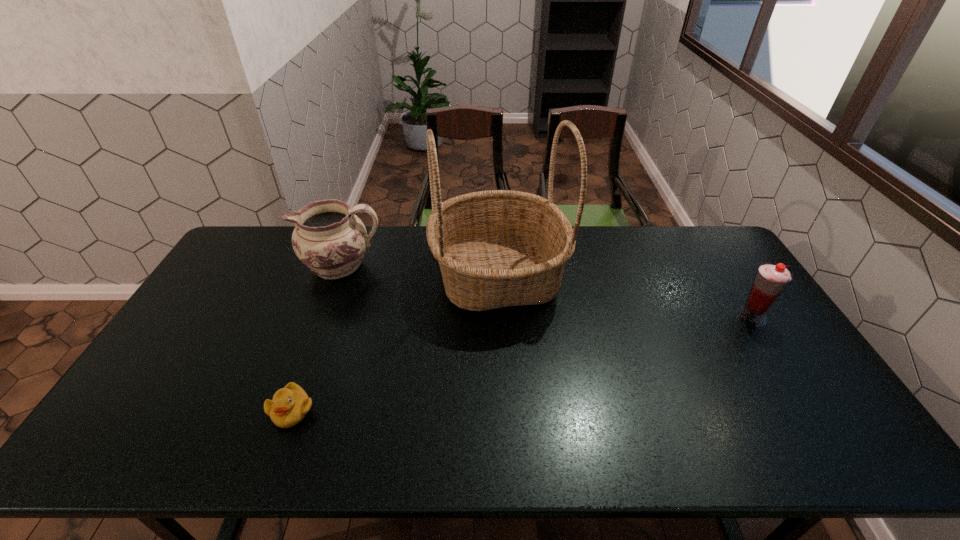
You are a GUI agent. You are given a task and a screenshot of the screen. Output one action in this format:
    pyautogui.click(x=<x>, y=<y>)
    Task: Click on the object that is the third closest to the nearest object
    
    Given the screenshot: What is the action you would take?
    pyautogui.click(x=771, y=279)

The width and height of the screenshot is (960, 540). In order to click on vacant area that satisfies the following two spatial constraints: 1. on the front side of the tallest object; 2. on the right side of the rightmost object in this screenshot , I will do `click(500, 316)`.

This screenshot has height=540, width=960. I want to click on vacant space that satisfies the following two spatial constraints: 1. on the spout of the pitcher; 2. on the right side of the third object from left to right, so click(339, 276).

Where is `free space in the image that satisfies the following two spatial constraints: 1. on the spout of the pitcher; 2. on the left side of the basket`? This screenshot has height=540, width=960. free space in the image that satisfies the following two spatial constraints: 1. on the spout of the pitcher; 2. on the left side of the basket is located at coordinates (339, 276).

Where is `free space that satisfies the following two spatial constraints: 1. on the front side of the smoothie; 2. on the left side of the third object from left to right`? This screenshot has height=540, width=960. free space that satisfies the following two spatial constraints: 1. on the front side of the smoothie; 2. on the left side of the third object from left to right is located at coordinates (500, 316).

Identify the location of free location that satisfies the following two spatial constraints: 1. on the spout of the basket; 2. on the left side of the pitcher. This screenshot has height=540, width=960. (339, 276).